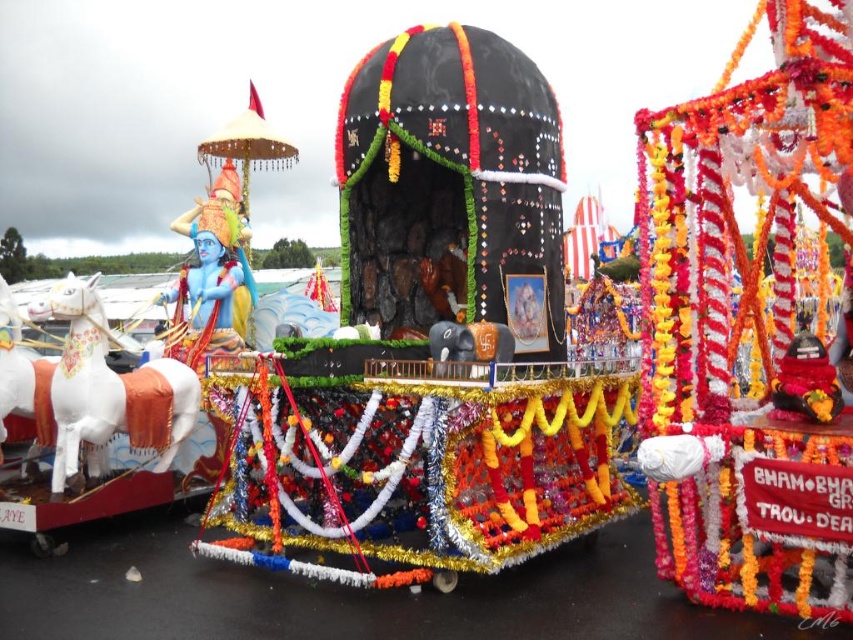
Question: Does white glossy horse at left have a smaller size compared to blue painted statue at left?

Choices:
 (A) yes
 (B) no

Answer: (B)

Question: From the image, what is the correct spatial relationship of blue painted statue at left in relation to shiny red statue at center?

Choices:
 (A) above
 (B) below

Answer: (A)

Question: Does white glossy horse at left appear on the right side of shiny red statue at center?

Choices:
 (A) yes
 (B) no

Answer: (B)

Question: Which point is closer to the camera?

Choices:
 (A) shiny red statue at center
 (B) blue painted statue at left

Answer: (A)

Question: Estimate the real-world distances between objects in this image. Which object is farther from the blue painted statue at left?

Choices:
 (A) white glossy horse at left
 (B) shiny red statue at center

Answer: (B)

Question: Which of these objects is positioned farthest from the blue painted statue at left?

Choices:
 (A) shiny red statue at center
 (B) white glossy horse at left

Answer: (A)